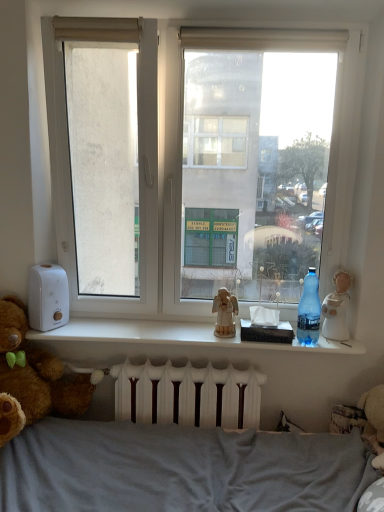
Identify the location of empty space that is ontop of white fabric curtain at upper center. (276, 22).